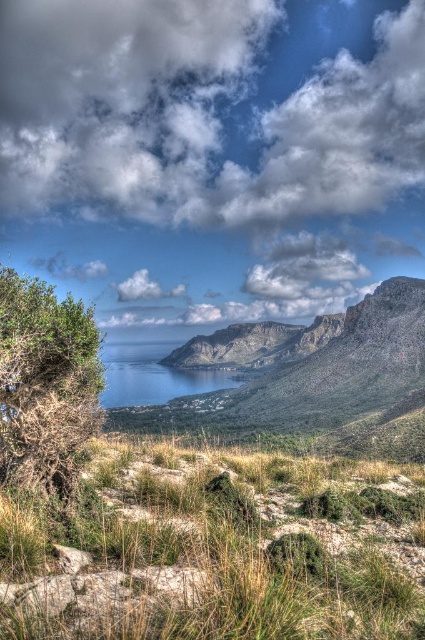
Question: Among these points, which one is nearest to the camera?

Choices:
 (A) (39, 509)
 (B) (226, 65)
 (C) (67, 397)
 (D) (167, 376)

Answer: (A)

Question: Can you confirm if cloudy sky at upper center is positioned above blue water at center?

Choices:
 (A) yes
 (B) no

Answer: (A)

Question: Which point appears closest to the camera in this image?

Choices:
 (A) (155, 368)
 (B) (85, 636)
 (C) (320, 228)
 (D) (74, 332)

Answer: (B)

Question: Which object appears farthest from the camera in this image?

Choices:
 (A) cloudy sky at upper center
 (B) green leafy bush at left

Answer: (A)

Question: Does cloudy sky at upper center appear over blue water at center?

Choices:
 (A) yes
 (B) no

Answer: (A)

Question: Is green grassy at lower center to the left of green leafy bush at left from the viewer's perspective?

Choices:
 (A) no
 (B) yes

Answer: (A)